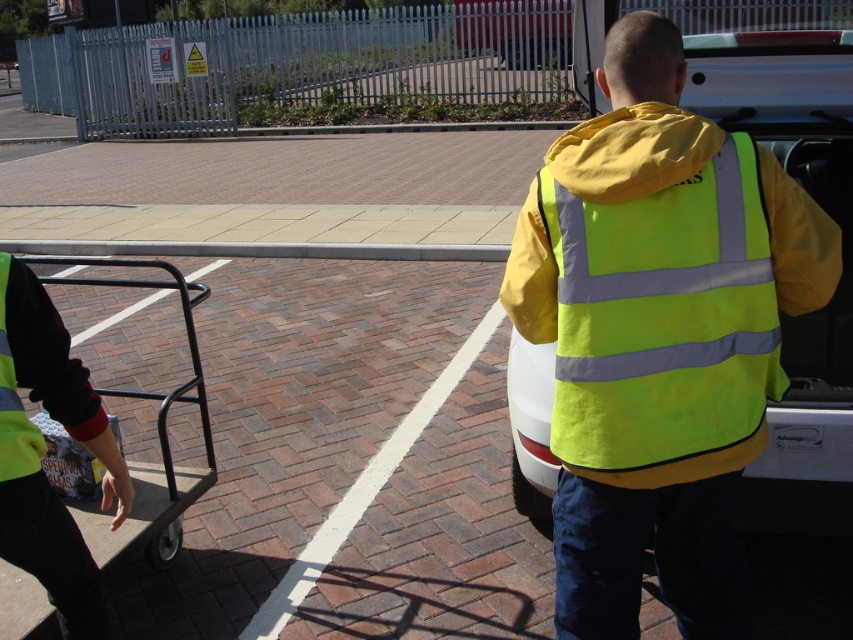
You are a delivery driver who needs to park your vehicle between the yellow reflective jacket at center and the black metal cart at lower left. Given that your vehicle is 2 meters wide, can you fit it between them?

The yellow reflective jacket at center is larger in size than the black metal cart at lower left, but the size comparison does not provide information about the distance between them. Therefore, it is unclear if the 2 meter wide vehicle can fit between them.